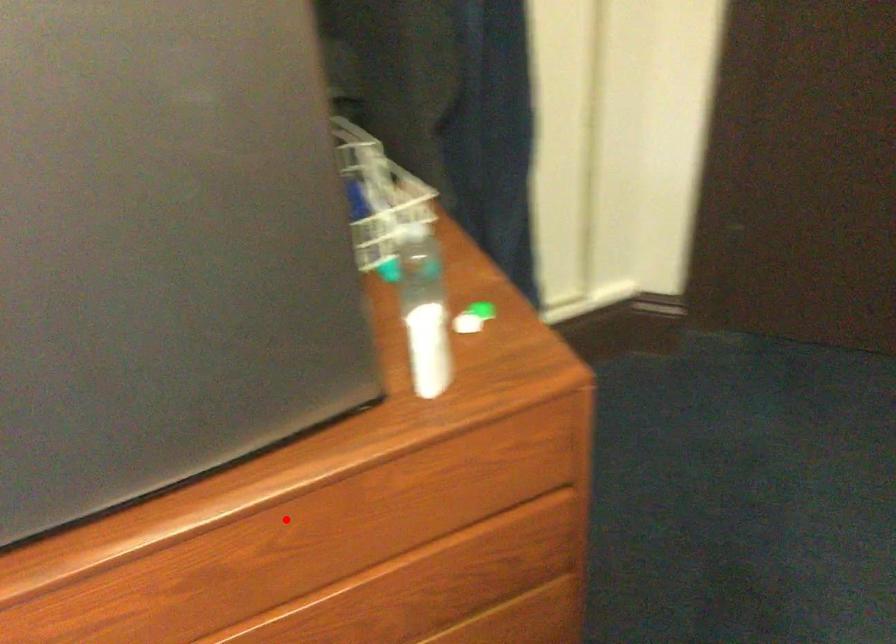
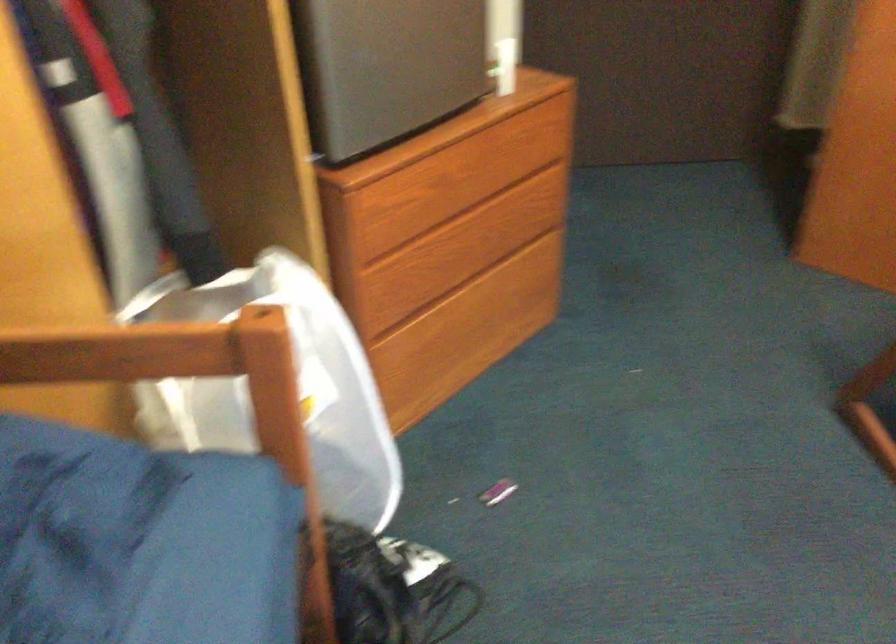
Question: I am providing you with two images of the same scene from different viewpoints. A red point is shown in image1. For the corresponding object point in image2, is it positioned nearer or farther from the camera?

Choices:
 (A) Nearer
 (B) Farther

Answer: (B)